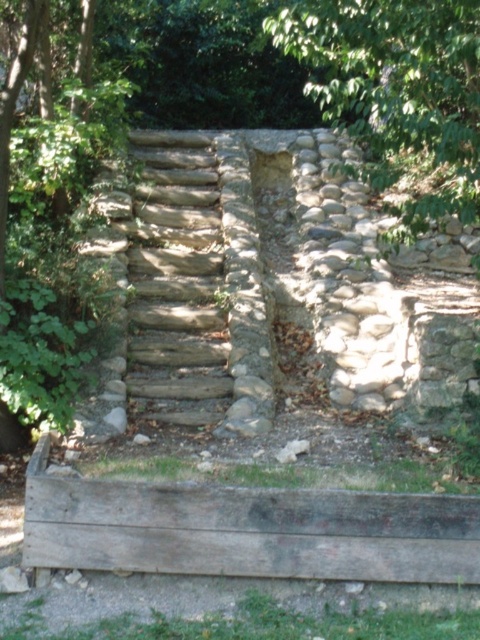
Question: Is weathered wood at lower center wider than green leafy tree at upper center?

Choices:
 (A) yes
 (B) no

Answer: (A)

Question: Is weathered wood at lower center to the right of green leafy tree at upper center from the viewer's perspective?

Choices:
 (A) no
 (B) yes

Answer: (A)

Question: Which point is farther to the camera?

Choices:
 (A) natural stone stairs at center
 (B) green leafy tree at upper center

Answer: (A)

Question: Estimate the real-world distances between objects in this image. Which object is farther from the weathered wood at lower center?

Choices:
 (A) natural stone stairs at center
 (B) green leafy tree at upper center

Answer: (B)

Question: Considering the real-world distances, which object is farthest from the weathered wood at lower center?

Choices:
 (A) natural stone stairs at center
 (B) green leafy tree at upper center

Answer: (B)

Question: Is green leafy tree at upper center to the left of natural stone stairs at center from the viewer's perspective?

Choices:
 (A) no
 (B) yes

Answer: (A)